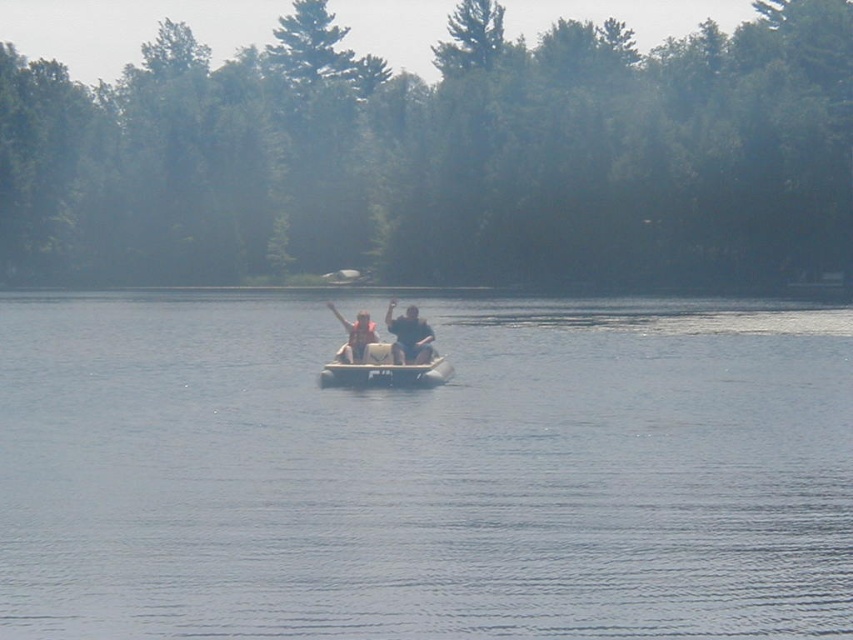
You are a swimmer who wants to retrieve the light brown wooden paddle boat at center from the water. To reach it, you need to swim past the dark blue fabric life vest at center. Is the paddle boat behind or in front of the life vest?

The light brown wooden paddle boat at center is behind the dark blue fabric life vest at center, so the paddle boat is behind the life vest.